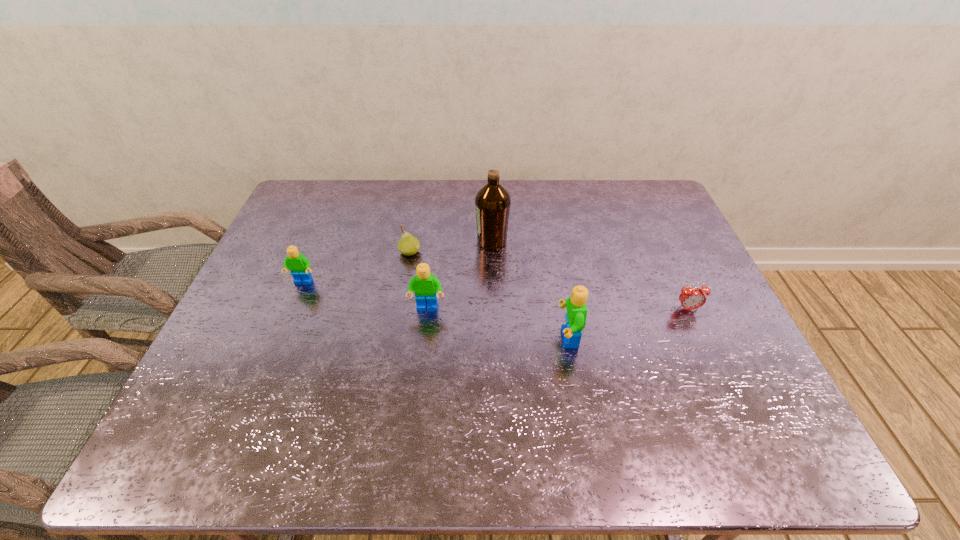
At what (x,y) coordinates should I click in order to perform the action: click on vacant position in the image that satisfies the following two spatial constraints: 1. on the label of the olive oil; 2. on the face of the second Lego from right to left. Please return your answer as a coordinate pair (x, y). The width and height of the screenshot is (960, 540). Looking at the image, I should click on (x=494, y=308).

This screenshot has width=960, height=540. I want to click on vacant position in the image that satisfies the following two spatial constraints: 1. on the label of the tallest object; 2. on the front side of the pear, so click(492, 252).